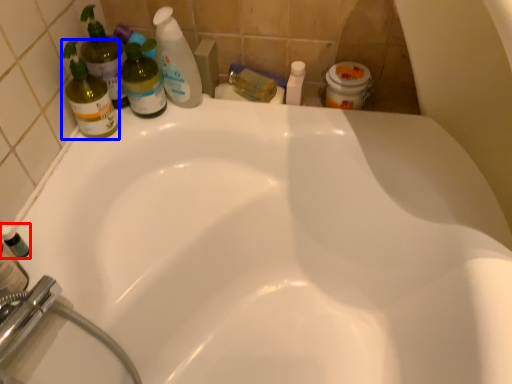
Question: Which object appears farthest to the camera in this image, mouthwash (highlighted by a red box) or cleaning product (highlighted by a blue box)?

Choices:
 (A) mouthwash
 (B) cleaning product

Answer: (B)